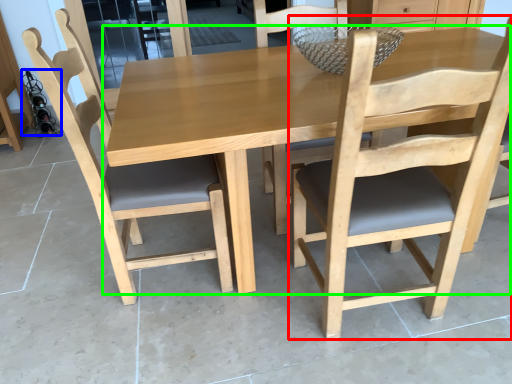
Question: Which object is positioned farthest from chair (highlighted by a red box)? Select from wine bottle (highlighted by a blue box) and kitchen & dining room table (highlighted by a green box).

Choices:
 (A) wine bottle
 (B) kitchen & dining room table

Answer: (A)